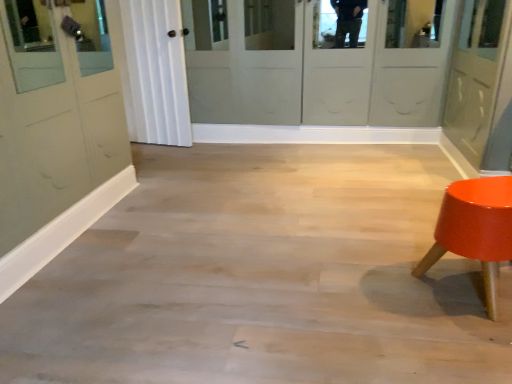
This screenshot has width=512, height=384. Describe the element at coordinates (481, 85) in the screenshot. I see `matte gray door at right` at that location.

Locate an element on the screen. The height and width of the screenshot is (384, 512). matte gray door at right is located at coordinates (481, 85).

The height and width of the screenshot is (384, 512). What do you see at coordinates (475, 229) in the screenshot? I see `shiny orange stool at right` at bounding box center [475, 229].

Image resolution: width=512 pixels, height=384 pixels. I want to click on shiny orange stool at right, so click(x=475, y=229).

Where is `matte gray door at right`? This screenshot has width=512, height=384. matte gray door at right is located at coordinates (481, 85).

Considering the positions of objects matte gray door at right and shiny orange stool at right in the image provided, who is more to the right, matte gray door at right or shiny orange stool at right?

matte gray door at right is more to the right.

Between matte gray door at right and shiny orange stool at right, which one is positioned behind?

matte gray door at right is more distant.

Does point (506, 43) come farther from viewer compared to point (466, 220)?

Yes, point (506, 43) is farther from viewer.

From the image's perspective, does matte gray door at right appear lower than shiny orange stool at right?

Actually, matte gray door at right appears above shiny orange stool at right in the image.

From a real-world perspective, is matte gray door at right located beneath shiny orange stool at right?

No.

Can you confirm if matte gray door at right is wider than shiny orange stool at right?

Indeed, matte gray door at right has a greater width compared to shiny orange stool at right.

In terms of height, does matte gray door at right look taller or shorter compared to shiny orange stool at right?

Considering their sizes, matte gray door at right has more height than shiny orange stool at right.

Based on their sizes in the image, would you say matte gray door at right is bigger or smaller than shiny orange stool at right?

In the image, matte gray door at right appears to be larger than shiny orange stool at right.

Can shiny orange stool at right be found inside matte gray door at right?

No.

Is matte gray door at right far away from shiny orange stool at right?

No, there isn't a large distance between matte gray door at right and shiny orange stool at right.

Could you tell me if matte gray door at right is turned towards shiny orange stool at right?

No, matte gray door at right is not facing towards shiny orange stool at right.

How distant is matte gray door at right from shiny orange stool at right?

matte gray door at right and shiny orange stool at right are 38.71 inches apart.

In order to click on furniture that appears in front of the matte gray door at right in this screenshot , I will do `click(475, 229)`.

Considering the positions of objects shiny orange stool at right and matte gray door at right in the image provided, who is more to the left, shiny orange stool at right or matte gray door at right?

Positioned to the left is shiny orange stool at right.

Is shiny orange stool at right in front of or behind matte gray door at right in the image?

Visually, shiny orange stool at right is located in front of matte gray door at right.

Does point (511, 248) appear closer or farther from the camera than point (451, 109)?

Point (511, 248) is positioned closer to the camera compared to point (451, 109).

From the image's perspective, is shiny orange stool at right on top of matte gray door at right?

No, from the image's perspective, shiny orange stool at right is not on top of matte gray door at right.

From a real-world perspective, who is located lower, shiny orange stool at right or matte gray door at right?

shiny orange stool at right, from a real-world perspective.

Considering the sizes of objects shiny orange stool at right and matte gray door at right in the image provided, who is thinner, shiny orange stool at right or matte gray door at right?

shiny orange stool at right is thinner.

Between shiny orange stool at right and matte gray door at right, which one has more height?

Standing taller between the two is matte gray door at right.

Which of these two, shiny orange stool at right or matte gray door at right, is bigger?

matte gray door at right.

Would you say shiny orange stool at right is inside or outside matte gray door at right?

shiny orange stool at right lies outside matte gray door at right.

Based on the photo, can you see shiny orange stool at right touching matte gray door at right?

No, shiny orange stool at right is not in contact with matte gray door at right.

Is shiny orange stool at right oriented towards matte gray door at right?

No, shiny orange stool at right is not oriented towards matte gray door at right.

What's the angular difference between shiny orange stool at right and matte gray door at right's facing directions?

176 degrees.

Locate an element on the screen. Image resolution: width=512 pixels, height=384 pixels. door above the shiny orange stool at right (from a real-world perspective) is located at coordinates (481, 85).

Locate an element on the screen. Image resolution: width=512 pixels, height=384 pixels. door lying above the shiny orange stool at right (from the image's perspective) is located at coordinates (481, 85).

You are a GUI agent. You are given a task and a screenshot of the screen. Output one action in this format:
    pyautogui.click(x=<x>, y=<y>)
    Task: Click on the furniture that is below the matte gray door at right (from the image's perspective)
    The width and height of the screenshot is (512, 384).
    Given the screenshot: What is the action you would take?
    pyautogui.click(x=475, y=229)